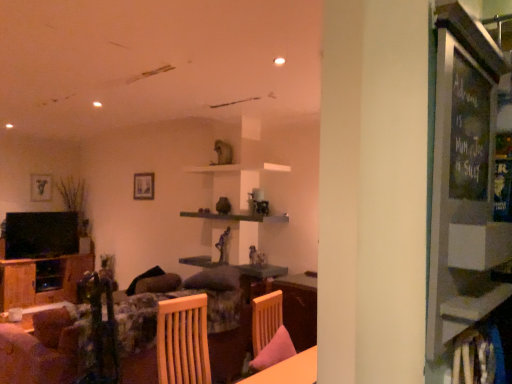
Question: Considering the positions of point (49, 190) and point (270, 221), is point (49, 190) closer or farther from the camera than point (270, 221)?

Choices:
 (A) farther
 (B) closer

Answer: (A)

Question: From their relative heights in the image, would you say matte black picture frame at upper left, the 1th picture frame when ordered from left to right, is taller or shorter than wooden shelf at center?

Choices:
 (A) tall
 (B) short

Answer: (A)

Question: Considering the real-world distances, which object is closest to the wooden shelf at center?

Choices:
 (A) floral fabric couch at lower left
 (B) matte black picture frame at upper left, marked as the second picture frame in a right-to-left arrangement
 (C) wooden cabinet at left
 (D) wooden table at lower center
 (E) matte glass picture frame at upper center, the 1th picture frame when ordered from right to left

Answer: (E)

Question: Which object is the farthest from the wooden shelf at center?

Choices:
 (A) matte glass picture frame at upper center, the 2th picture frame when ordered from left to right
 (B) floral fabric couch at lower left
 (C) wooden cabinet at left
 (D) matte black picture frame at upper left, marked as the second picture frame in a right-to-left arrangement
 (E) wooden table at lower center

Answer: (D)